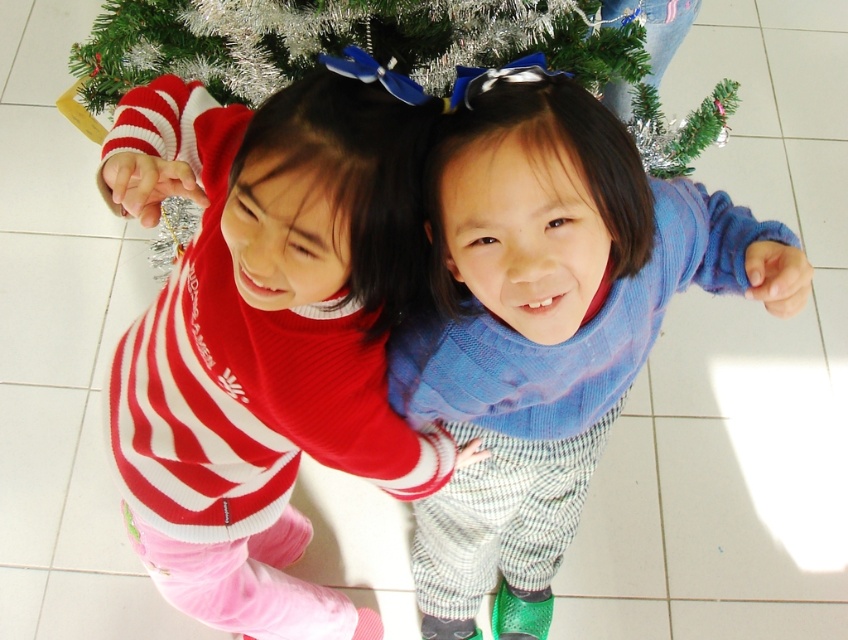
The image size is (848, 640). I want to click on blue knitted sweater at center, so click(x=547, y=321).

Does blue knitted sweater at center have a lesser width compared to green tinsel christmas tree at center?

Indeed, blue knitted sweater at center has a lesser width compared to green tinsel christmas tree at center.

Where is `blue knitted sweater at center`? The image size is (848, 640). blue knitted sweater at center is located at coordinates (547, 321).

Where is `blue knitted sweater at center`? blue knitted sweater at center is located at coordinates (547, 321).

Does matte red sweater at center appear on the left side of green tinsel christmas tree at center?

Indeed, matte red sweater at center is positioned on the left side of green tinsel christmas tree at center.

Between matte red sweater at center and green tinsel christmas tree at center, which one has less height?

green tinsel christmas tree at center is shorter.

Where is `matte red sweater at center`? matte red sweater at center is located at coordinates (266, 337).

Who is positioned more to the left, matte red sweater at center or blue knitted sweater at center?

Positioned to the left is matte red sweater at center.

The height and width of the screenshot is (640, 848). Find the location of `matte red sweater at center`. matte red sweater at center is located at coordinates (266, 337).